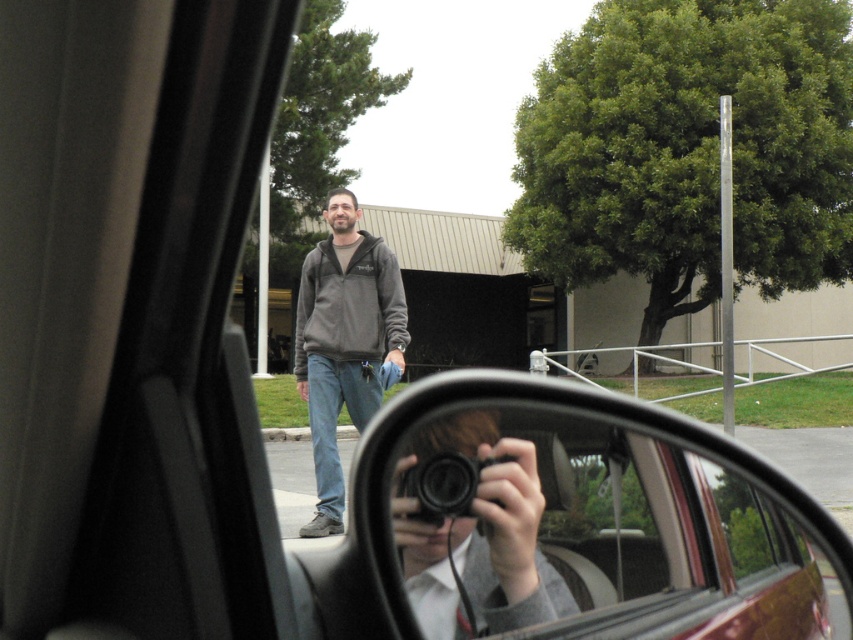
You are inside a car and want to take a photo of the man outside using the black plastic camera at center. However, the shiny black mirror at center is blocking your view. Can you tell me which object you need to move to get a clear shot of the man?

The shiny black mirror at center is larger than the black plastic camera at center, so you need to move the shiny black mirror at center to get a clear shot of the man.

You are inside a car and want to know if the shiny black mirror at center can fully show the black plastic camera at center. Based on their sizes, can it?

The shiny black mirror at center is taller than the black plastic camera at center, so it can fully show the black plastic camera at center in the reflection.

Consider the image. You are inside a car and looking at the side mirror. You see a point at coordinates [344,340]. What object is located at that point?

The dark gray hoodie at center is located at point [344,340].